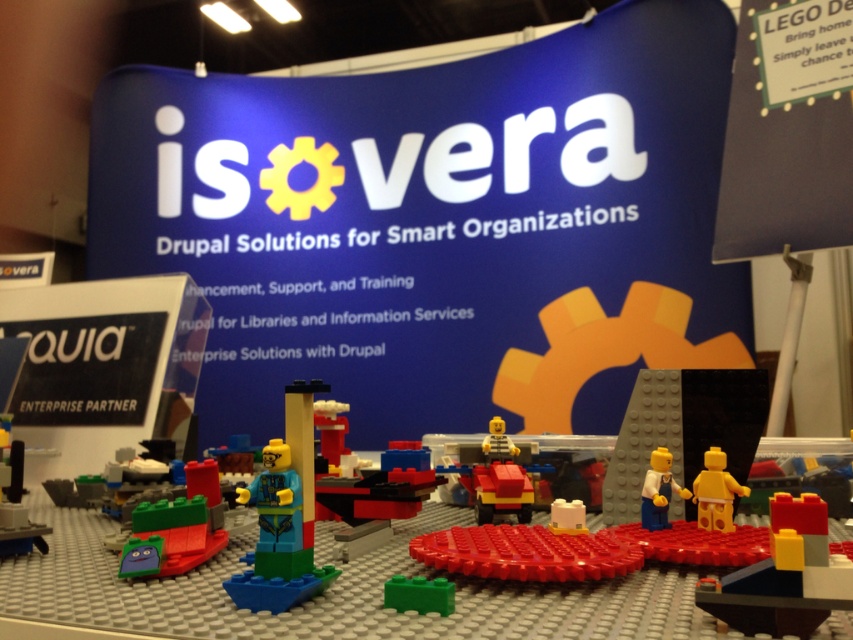
You are standing at the center of the booth. You need to place a new object at the same 2D location as the green matte toy at lower left. What coordinates should you use?

The coordinates for the green matte toy at lower left are at point (178, 525), so you should place the new object at those coordinates.

Based on the photo, you are at the isovera booth and see the brick red plastic toy at center and the yellow plastic minifigure at center. Which one is more to the left?

The brick red plastic toy at center is more to the left than the yellow plastic minifigure at center.